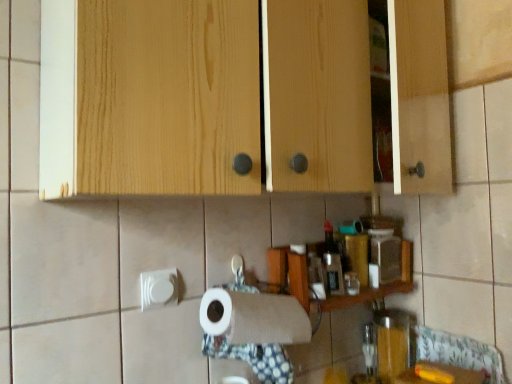
Question: Is translucent glass jar at lower right facing towards smooth wooden counter at lower right?

Choices:
 (A) no
 (B) yes

Answer: (B)

Question: Can you confirm if translucent glass jar at lower right is wider than smooth wooden counter at lower right?

Choices:
 (A) no
 (B) yes

Answer: (A)

Question: Is translucent glass jar at lower right outside smooth wooden counter at lower right?

Choices:
 (A) yes
 (B) no

Answer: (A)

Question: From the image's perspective, is translucent glass jar at lower right located above smooth wooden counter at lower right?

Choices:
 (A) no
 (B) yes

Answer: (B)

Question: Is translucent glass jar at lower right to the left of smooth wooden counter at lower right from the viewer's perspective?

Choices:
 (A) yes
 (B) no

Answer: (A)

Question: From a real-world perspective, does translucent glass jar at lower right sit lower than smooth wooden counter at lower right?

Choices:
 (A) no
 (B) yes

Answer: (A)

Question: From the image's perspective, does translucent glass jar at lower right appear higher than wooden shelf at center?

Choices:
 (A) yes
 (B) no

Answer: (B)

Question: Does translucent glass jar at lower right have a lesser width compared to wooden shelf at center?

Choices:
 (A) no
 (B) yes

Answer: (B)

Question: Is translucent glass jar at lower right bigger than wooden shelf at center?

Choices:
 (A) no
 (B) yes

Answer: (A)

Question: From a real-world perspective, is translucent glass jar at lower right located beneath wooden shelf at center?

Choices:
 (A) yes
 (B) no

Answer: (A)

Question: Is translucent glass jar at lower right beside wooden shelf at center?

Choices:
 (A) no
 (B) yes

Answer: (A)

Question: Is translucent glass jar at lower right aimed at wooden shelf at center?

Choices:
 (A) yes
 (B) no

Answer: (B)

Question: Are wooden shelf at center and smooth wooden counter at lower right far apart?

Choices:
 (A) no
 (B) yes

Answer: (A)